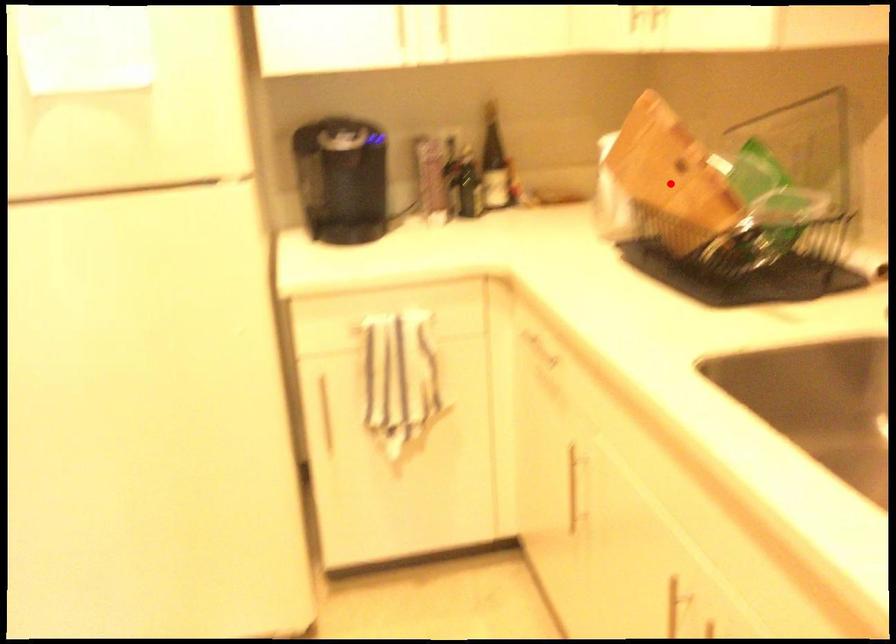
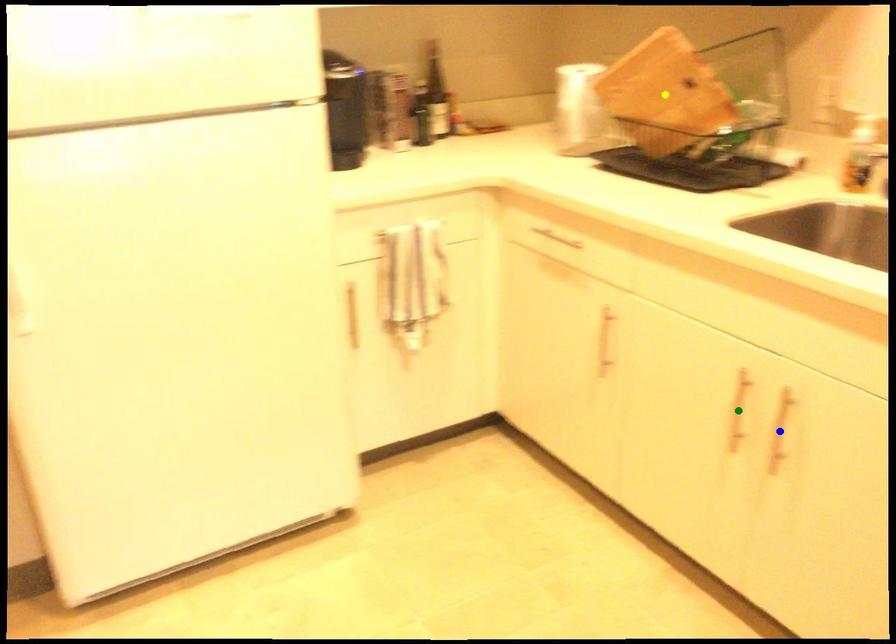
Question: I am providing you with two images of the same scene from different viewpoints. A red point is marked on the first image. You are given multiple points on the second image. In image 2, which mark is for the same physical point as the one in image 1?

Choices:
 (A) yellow point
 (B) green point
 (C) blue point

Answer: (A)